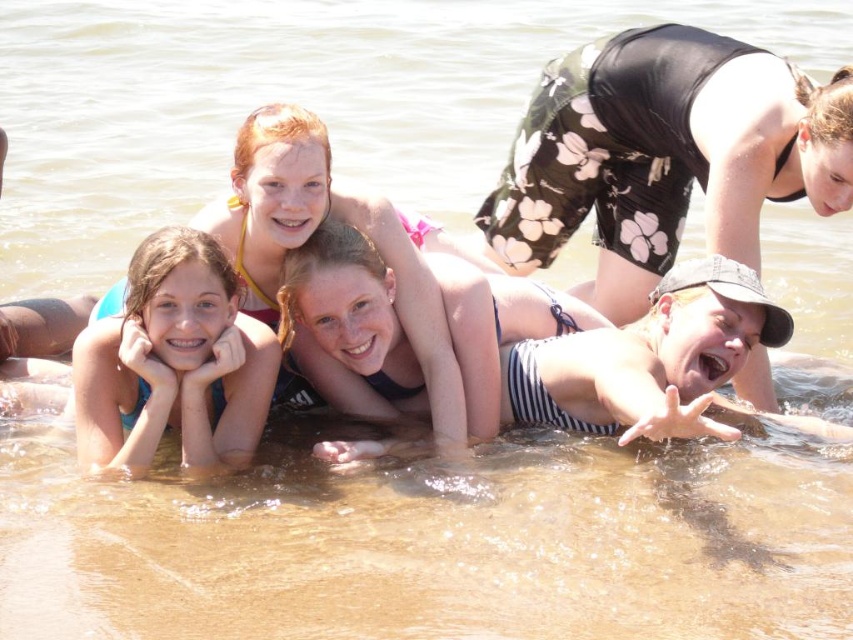
You are a photographer trying to capture a group photo of the striped swimsuit at center and the blue fabric at lower left. Based on their heights, which one should you focus on to ensure they are both in frame without needing to adjust your camera angle?

The striped swimsuit at center is taller than the blue fabric at lower left, so you should focus on the striped swimsuit at center to ensure both are in frame without needing to adjust your camera angle.

You are a lifeguard on duty and need to reach both the striped swimsuit at center and the blue fabric at lower left. Given that you can swim 100 feet per minute, how long will it take you to reach each object starting from your current position at the center?

The striped swimsuit at center is right at your current position, so it takes 0 minutes. The blue fabric at lower left is 60.02 feet away, so it would take approximately 0.6 minutes or 36 seconds to reach it.